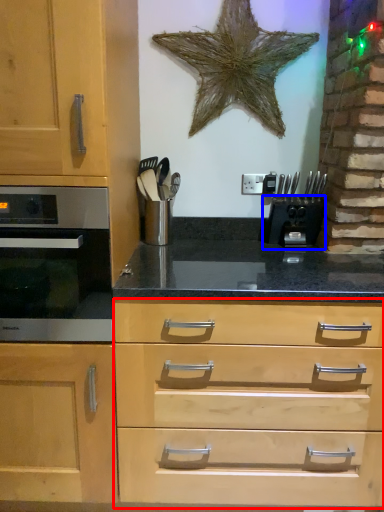
Question: Which point is closer to the camera, drawer (highlighted by a red box) or coffee machine (highlighted by a blue box)?

Choices:
 (A) drawer
 (B) coffee machine

Answer: (A)